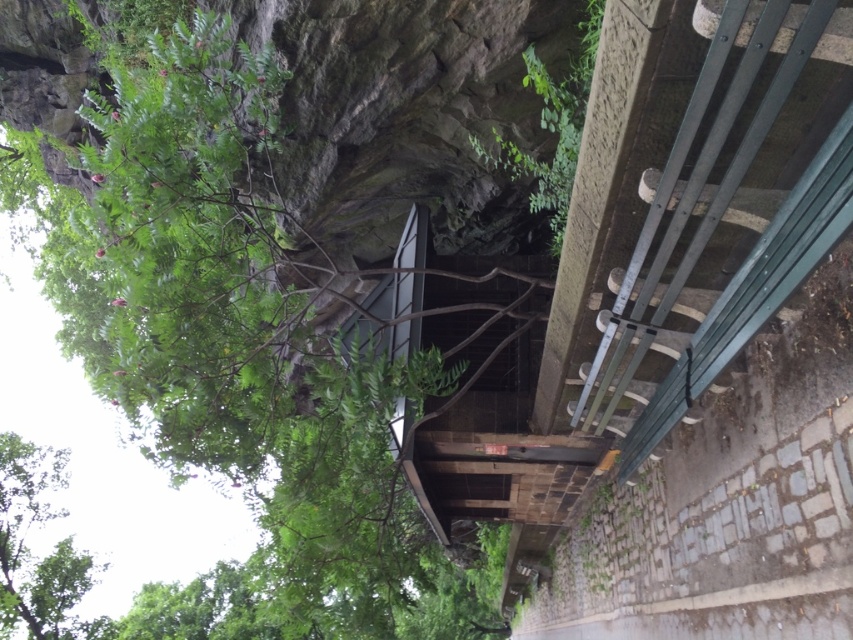
You are a hiker who wants to take a photo of the green leafy tree at upper left and the green leafy tree at lower left. Which tree should you focus on if you want to capture a wider view of the foliage?

The green leafy tree at upper left has a greater width than the green leafy tree at lower left, so focusing on it will allow you to capture a wider view of the foliage.

From the picture: Please provide the 2D coordinates of the green leafy tree at upper left in the scene.

The green leafy tree at upper left is located at the 2D coordinates of point [234,342].